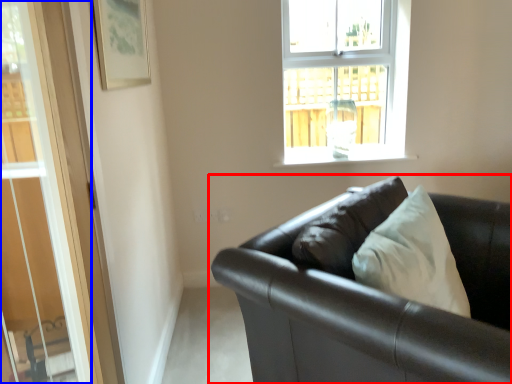
Question: Among these objects, which one is farthest to the camera, studio couch (highlighted by a red box) or glass door (highlighted by a blue box)?

Choices:
 (A) studio couch
 (B) glass door

Answer: (A)